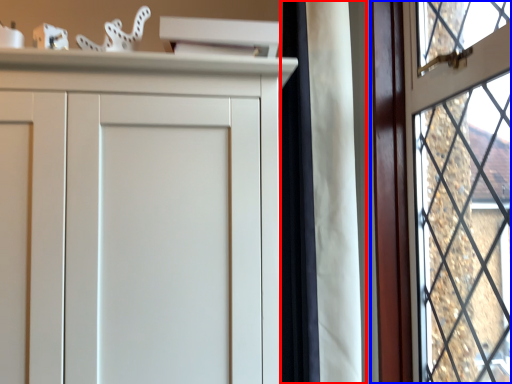
Question: Which point is further to the camera, curtain (highlighted by a red box) or window (highlighted by a blue box)?

Choices:
 (A) curtain
 (B) window

Answer: (A)